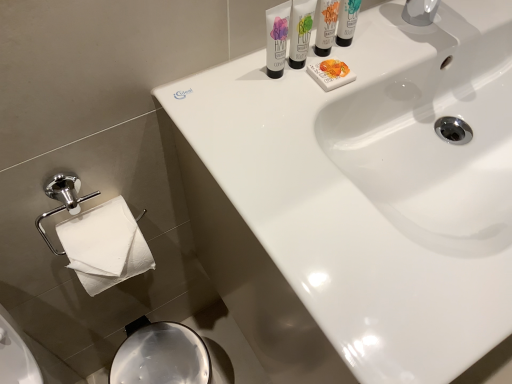
Where is `free space in front of white matte soap at upper center`? The height and width of the screenshot is (384, 512). free space in front of white matte soap at upper center is located at coordinates (308, 180).